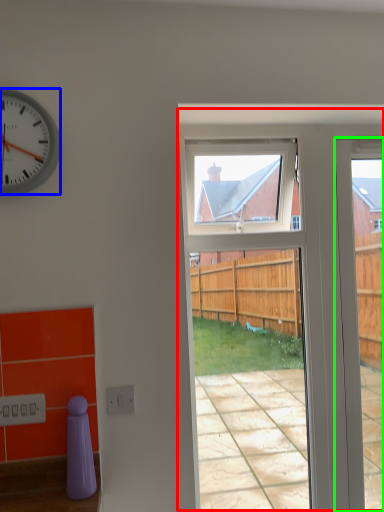
Question: Which object is the closest to the screen door (highlighted by a red box)? Choose among these: clock (highlighted by a blue box) or door (highlighted by a green box).

Choices:
 (A) clock
 (B) door

Answer: (B)